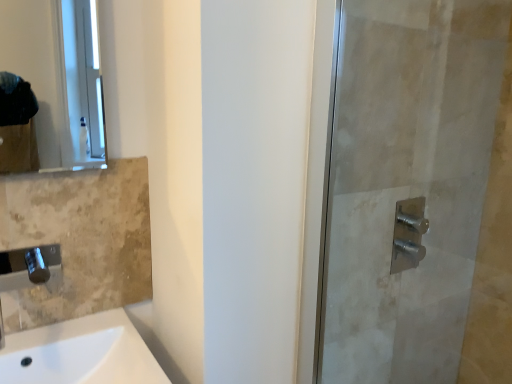
Question: Does matte glass mirror at upper left have a smaller size compared to white ceramic sink at lower left?

Choices:
 (A) no
 (B) yes

Answer: (B)

Question: Does matte glass mirror at upper left have a greater width compared to white ceramic sink at lower left?

Choices:
 (A) no
 (B) yes

Answer: (A)

Question: Considering the relative sizes of matte glass mirror at upper left and white ceramic sink at lower left in the image provided, is matte glass mirror at upper left taller than white ceramic sink at lower left?

Choices:
 (A) yes
 (B) no

Answer: (A)

Question: Is matte glass mirror at upper left outside of white ceramic sink at lower left?

Choices:
 (A) no
 (B) yes

Answer: (B)

Question: Is matte glass mirror at upper left thinner than white ceramic sink at lower left?

Choices:
 (A) no
 (B) yes

Answer: (B)

Question: Is matte glass mirror at upper left positioned behind white ceramic sink at lower left?

Choices:
 (A) no
 (B) yes

Answer: (B)

Question: Considering the relative sizes of satin nickel faucet at right and satin nickel shower handle at right in the image provided, is satin nickel faucet at right wider than satin nickel shower handle at right?

Choices:
 (A) no
 (B) yes

Answer: (B)

Question: Is satin nickel faucet at right not inside satin nickel shower handle at right?

Choices:
 (A) yes
 (B) no

Answer: (B)

Question: Does satin nickel faucet at right lie in front of satin nickel shower handle at right?

Choices:
 (A) no
 (B) yes

Answer: (A)

Question: Can you confirm if satin nickel faucet at right is shorter than satin nickel shower handle at right?

Choices:
 (A) no
 (B) yes

Answer: (B)

Question: Is satin nickel faucet at right positioned far away from satin nickel shower handle at right?

Choices:
 (A) yes
 (B) no

Answer: (B)

Question: From the image's perspective, would you say satin nickel faucet at right is shown under satin nickel shower handle at right?

Choices:
 (A) yes
 (B) no

Answer: (A)

Question: Would you say polished chrome faucet at lower left is a long distance from matte glass mirror at upper left?

Choices:
 (A) no
 (B) yes

Answer: (B)